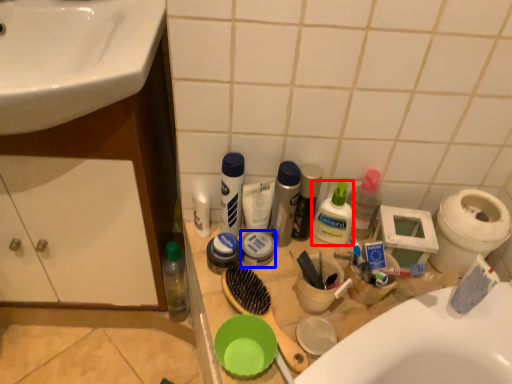
Question: Which object appears farthest to the camera in this image, toiletry (highlighted by a red box) or toiletry (highlighted by a blue box)?

Choices:
 (A) toiletry
 (B) toiletry

Answer: (B)